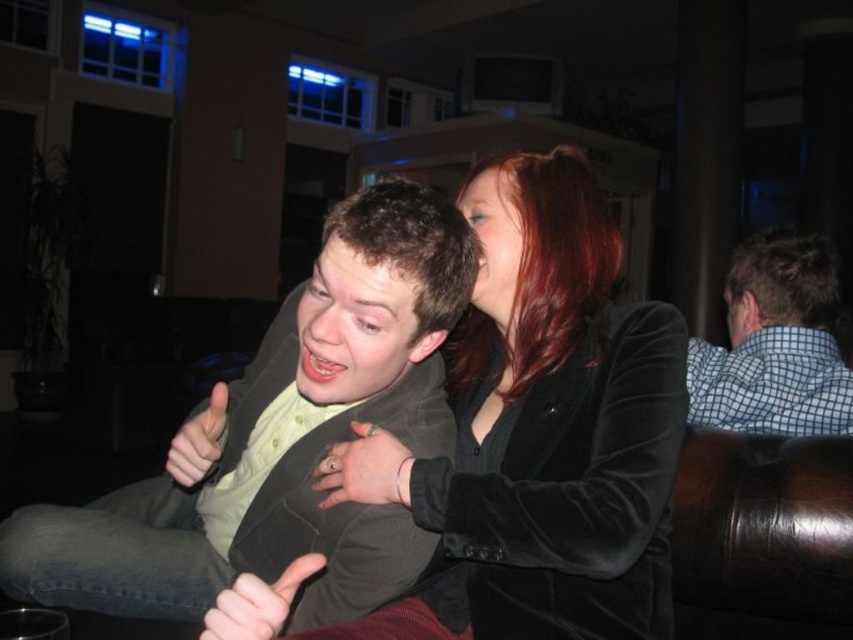
You are a photographer trying to capture a candid shot of the checkered fabric shirt at right and the smooth red hair at upper center. Since you want both subjects to be in focus, which one should you focus on first to ensure the other is also in focus?

The checkered fabric shirt at right is positioned under smooth red hair at upper center, so focusing on the smooth red hair at upper center first will ensure the checkered fabric shirt at right is also in focus because it is closer to the camera.

You are a photographer trying to capture a candid shot of the matte green shirt at center and the smooth red hair at upper center. Since you want to focus on both subjects equally, which one should you adjust your camera angle to prioritize? Explain your reasoning based on their positions.

The matte green shirt at center is positioned under the smooth red hair at upper center. To focus on both equally, you should angle the camera slightly upward to ensure both the lower matte green shirt at center and the upper smooth red hair at upper center are in clear view.

You are a photographer trying to focus on the matte green shirt at center and the smooth red hair at upper center. Which object should you adjust your camera to prioritize focusing on if you want to capture the foreground subject clearly?

The matte green shirt at center should be prioritized for focus since it is in front of the smooth red hair at upper center, making it the foreground subject.